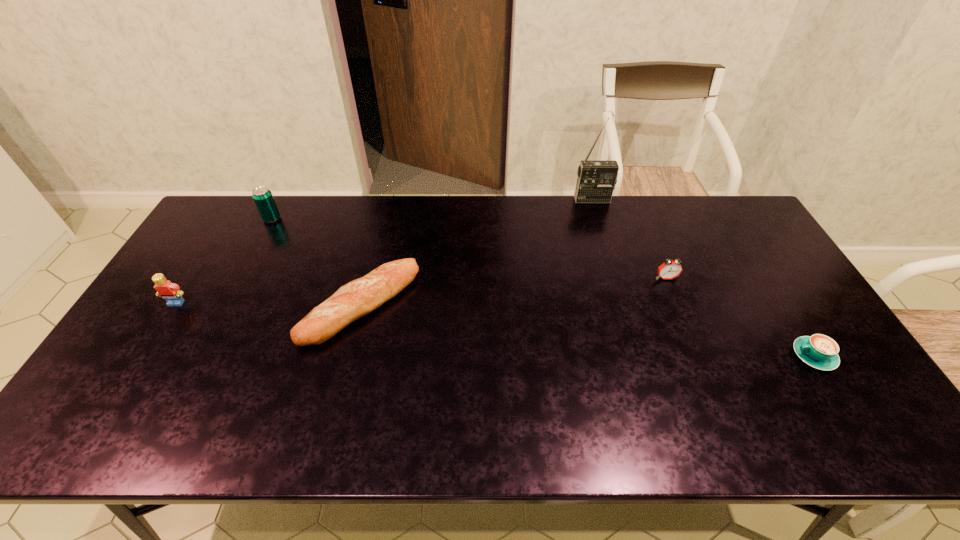
Find the location of `vacant position located on the right of the fifth nearest object`. vacant position located on the right of the fifth nearest object is located at coordinates (338, 219).

At what (x,y) coordinates should I click in order to perform the action: click on free region located 0.100m on the front-facing side of the Lego. Please return your answer as a coordinate pair (x, y). The image size is (960, 540). Looking at the image, I should click on (156, 335).

Identify the location of free space located 0.070m on the clock face of the alarm clock. The height and width of the screenshot is (540, 960). (675, 299).

I want to click on vacant point located on the left of the baguet, so click(x=167, y=305).

Find the location of `blank space located 0.060m with the handle on the right side of the cappuccino`. blank space located 0.060m with the handle on the right side of the cappuccino is located at coordinates (770, 356).

I want to click on vacant point located 0.400m with the handle on the right side of the cappuccino, so click(639, 356).

Identify the location of blank space located with the handle on the right side of the cappuccino. (x=674, y=356).

This screenshot has height=540, width=960. Identify the location of radio receiver present at the far edge. (596, 180).

This screenshot has height=540, width=960. What are the coordinates of `beer can at the far edge` in the screenshot? It's located at (262, 196).

The height and width of the screenshot is (540, 960). I want to click on object that is at the left edge, so click(x=169, y=291).